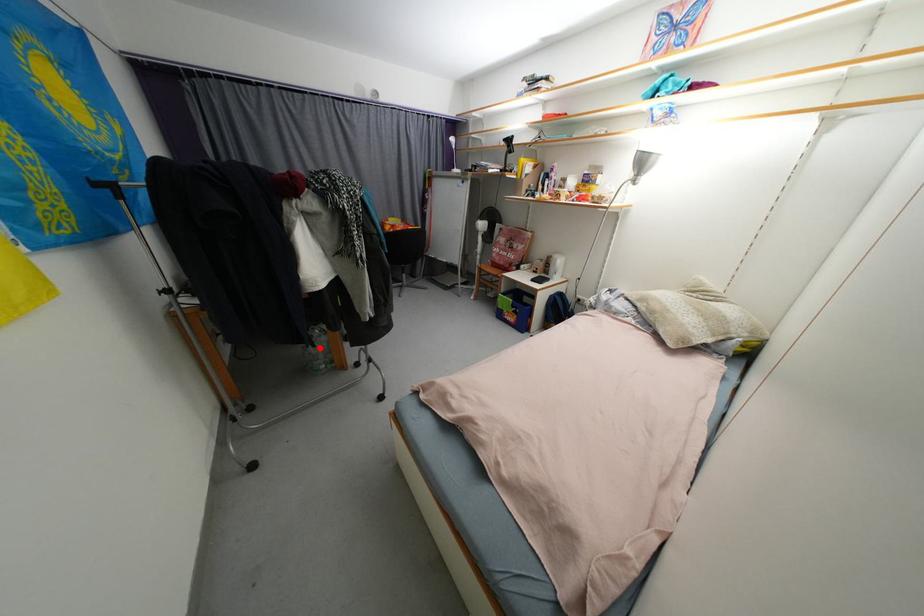
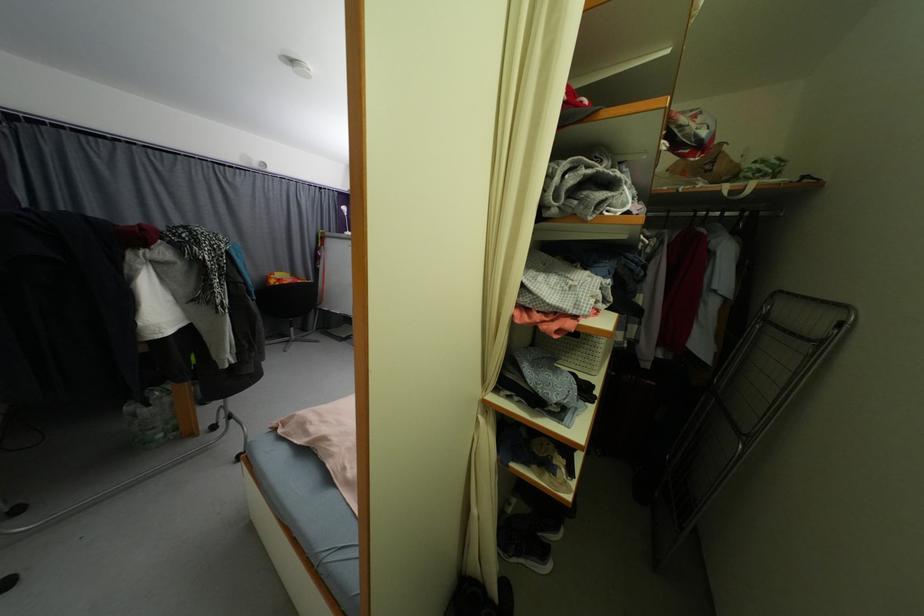
Question: I am providing you with two images of the same scene from different viewpoints. In image1, a red point is highlighted. Considering the same 3D point in image2, which of the following is correct?

Choices:
 (A) It is closer
 (B) It is farther

Answer: (B)